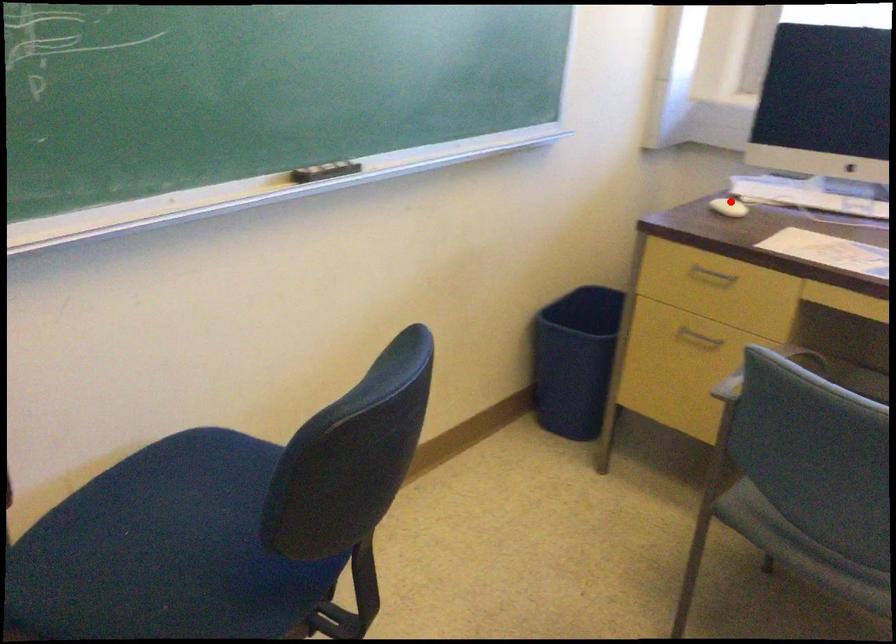
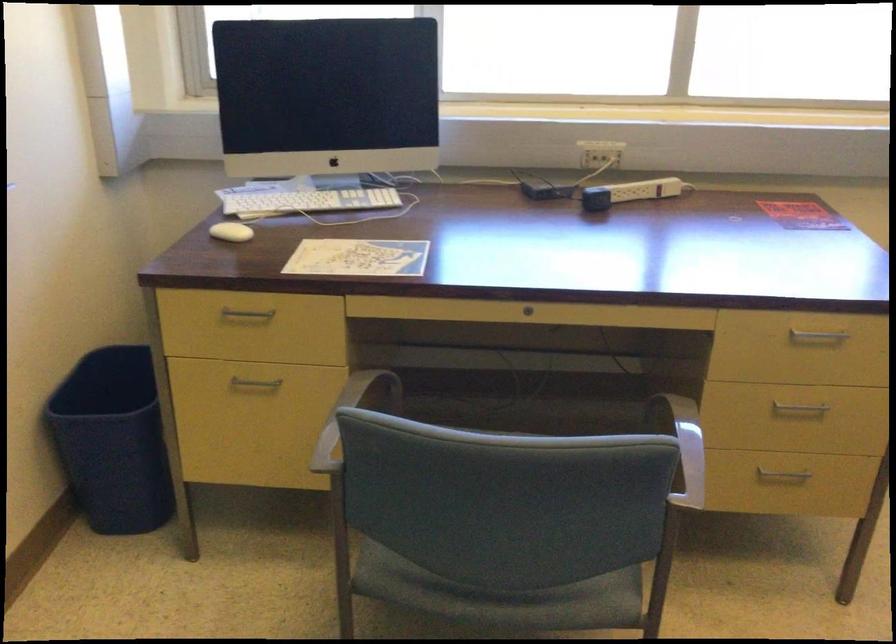
Question: I am providing you with two images of the same scene from different viewpoints. A red point is shown in image1. For the corresponding object point in image2, is it positioned nearer or farther from the camera?

Choices:
 (A) Nearer
 (B) Farther

Answer: (A)